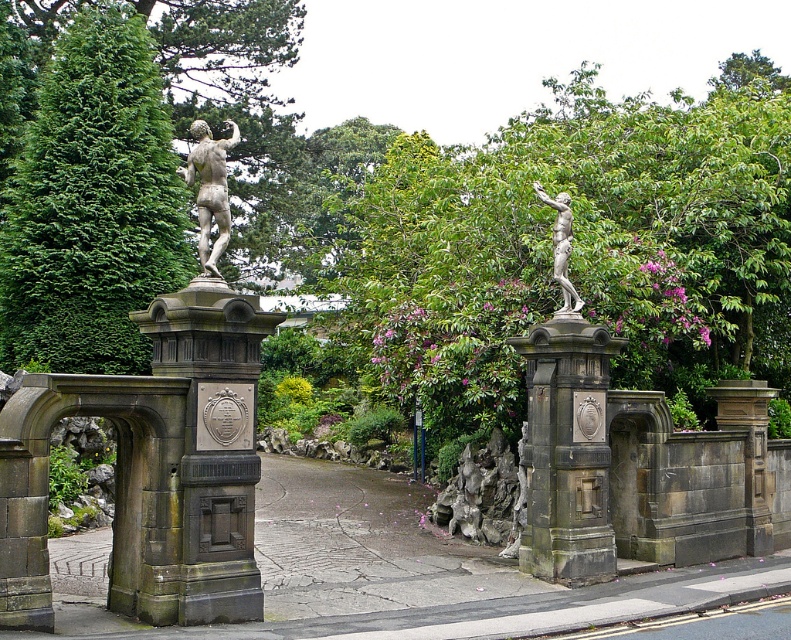
In the scene shown: You are standing at the entrance of the grand gate and want to take a photo that includes both point (214, 284) and point (554, 516). Which point should you focus on first to ensure both are in focus?

You should focus on point (214, 284) first because it is closer to the camera than point (554, 516). This ensures that both points will be within the depth of field.

Consider the image. You are a gardener planning to plant a new tree that requires 3 meters of space. You see the green leafy tree at center and the dark gray stone gate at center. Which object could potentially accommodate the new tree if planted next to it, based on their widths?

The green leafy tree at center might be wider than the dark gray stone gate at center, so planting the new tree next to the green leafy tree at center would be more likely to provide the required 3 meters of space.